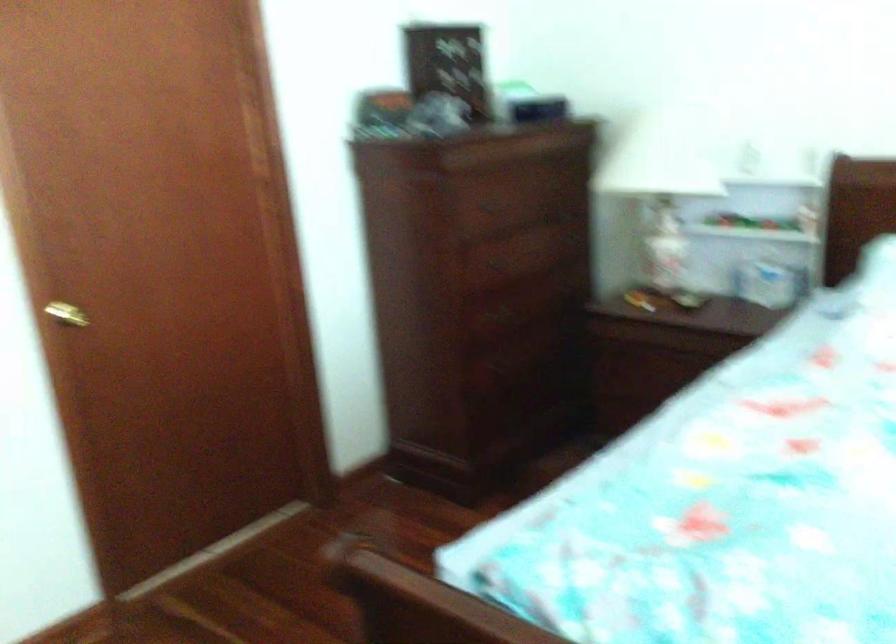
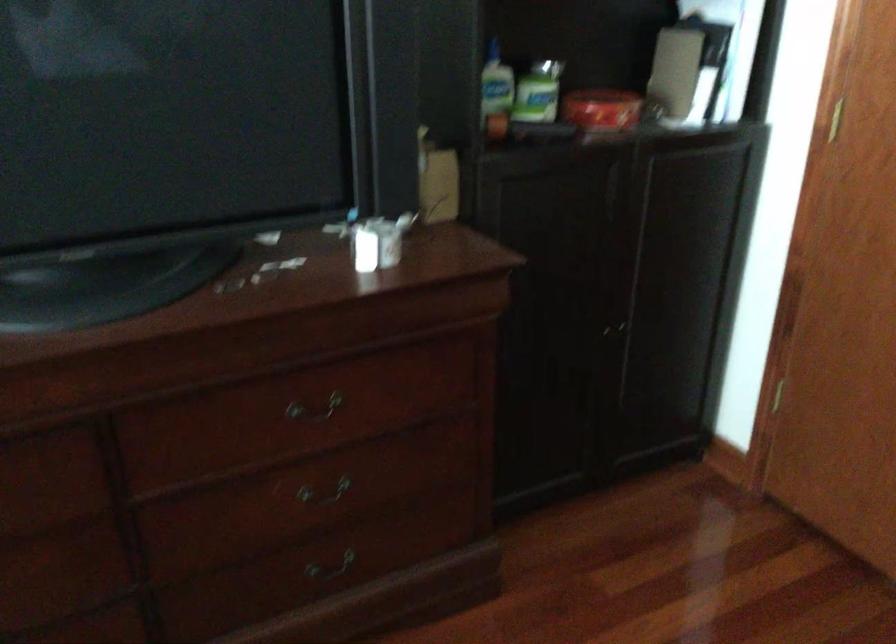
How did the camera likely rotate?

The rotation direction of the camera is left-down.